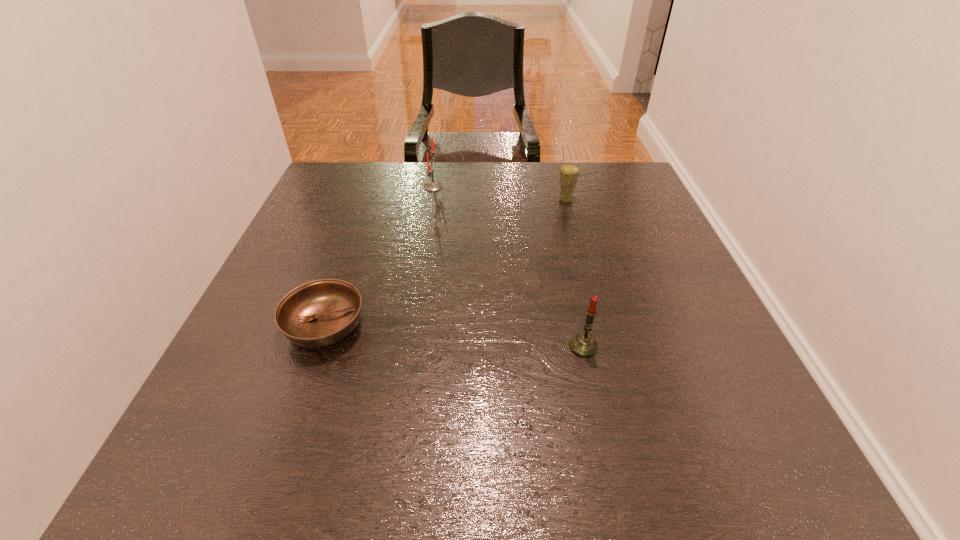
Find the location of a particular element. This screenshot has width=960, height=540. straw for drinking at the far edge is located at coordinates (569, 172).

At what (x,y) coordinates should I click in order to perform the action: click on candle at the far edge. Please return your answer as a coordinate pair (x, y). Looking at the image, I should click on (431, 186).

At what (x,y) coordinates should I click in order to perform the action: click on object present at the left edge. Please return your answer as a coordinate pair (x, y). This screenshot has width=960, height=540. Looking at the image, I should click on (320, 313).

The width and height of the screenshot is (960, 540). In order to click on free region at the far edge of the desktop in this screenshot , I will do `click(477, 186)`.

You are a GUI agent. You are given a task and a screenshot of the screen. Output one action in this format:
    pyautogui.click(x=<x>, y=<y>)
    Task: Click on the blank space at the near edge of the desktop
    The image size is (960, 540).
    Given the screenshot: What is the action you would take?
    pyautogui.click(x=561, y=449)

Identify the location of vacant space at the left edge. (317, 237).

I want to click on vacant space at the right edge of the desktop, so click(621, 237).

The height and width of the screenshot is (540, 960). I want to click on free space at the far left corner of the desktop, so click(x=364, y=185).

Locate an element on the screen. vacant space at the far right corner is located at coordinates (636, 193).

Find the location of a particular element. vacant point located between the shortest object and the right candle is located at coordinates (454, 336).